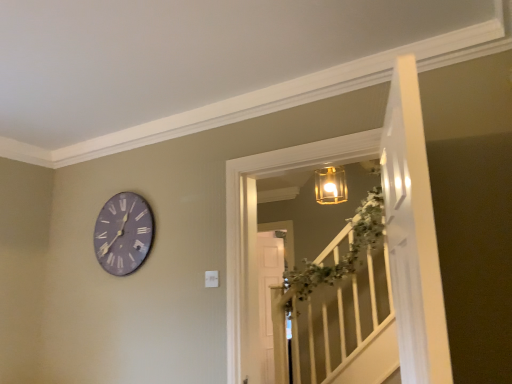
Question: Is the depth of translucent glass lantern at upper center less than that of purple matte clock at upper left?

Choices:
 (A) no
 (B) yes

Answer: (B)

Question: Considering the relative sizes of translucent glass lantern at upper center and purple matte clock at upper left in the image provided, is translucent glass lantern at upper center bigger than purple matte clock at upper left?

Choices:
 (A) no
 (B) yes

Answer: (B)

Question: Considering the relative sizes of translucent glass lantern at upper center and purple matte clock at upper left in the image provided, is translucent glass lantern at upper center smaller than purple matte clock at upper left?

Choices:
 (A) no
 (B) yes

Answer: (A)

Question: Is the surface of translucent glass lantern at upper center in direct contact with purple matte clock at upper left?

Choices:
 (A) yes
 (B) no

Answer: (B)

Question: Is purple matte clock at upper left at the back of translucent glass lantern at upper center?

Choices:
 (A) yes
 (B) no

Answer: (B)

Question: From the image's perspective, relative to translucent glass lantern at upper center, is white glossy door at upper right above or below?

Choices:
 (A) below
 (B) above

Answer: (B)

Question: Looking at their shapes, would you say white glossy door at upper right is wider or thinner than translucent glass lantern at upper center?

Choices:
 (A) thin
 (B) wide

Answer: (A)

Question: Is white glossy door at upper right bigger or smaller than translucent glass lantern at upper center?

Choices:
 (A) big
 (B) small

Answer: (B)

Question: In terms of height, does white glossy door at upper right look taller or shorter compared to translucent glass lantern at upper center?

Choices:
 (A) tall
 (B) short

Answer: (A)

Question: Do you think purple matte clock at upper left is within white glossy door at upper right, or outside of it?

Choices:
 (A) outside
 (B) inside

Answer: (A)

Question: In the image, is purple matte clock at upper left positioned in front of or behind white glossy door at upper right?

Choices:
 (A) behind
 (B) front

Answer: (A)

Question: From a real-world perspective, is purple matte clock at upper left physically located above or below white glossy door at upper right?

Choices:
 (A) below
 (B) above

Answer: (B)

Question: Considering the positions of purple matte clock at upper left and white glossy door at upper right in the image, is purple matte clock at upper left bigger or smaller than white glossy door at upper right?

Choices:
 (A) big
 (B) small

Answer: (B)

Question: From a real-world perspective, is translucent glass lantern at upper center physically located above or below white glossy door at upper right?

Choices:
 (A) above
 (B) below

Answer: (B)

Question: In terms of size, does translucent glass lantern at upper center appear bigger or smaller than white glossy door at upper right?

Choices:
 (A) big
 (B) small

Answer: (A)